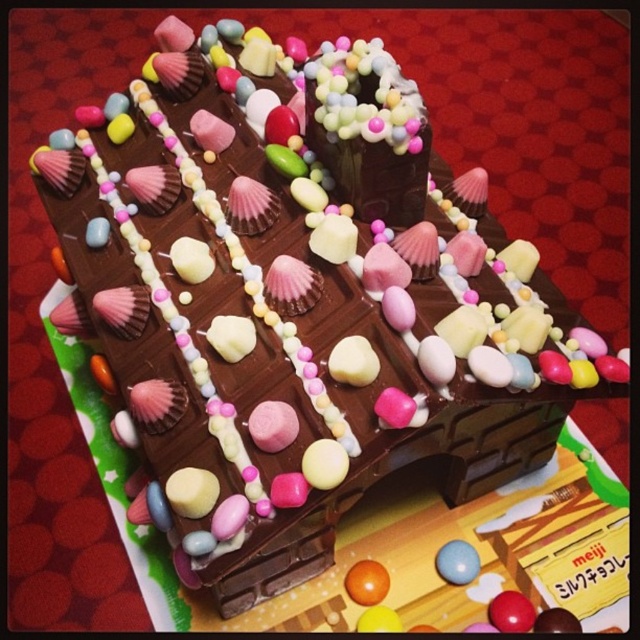
Question: Is the position of orange glossy candy at center less distant than that of matte blue sphere at center?

Choices:
 (A) yes
 (B) no

Answer: (A)

Question: Which object appears closest to the camera in this image?

Choices:
 (A) matte blue sphere at center
 (B) orange glossy candy at center

Answer: (B)

Question: Among these objects, which one is farthest from the camera?

Choices:
 (A) matte blue sphere at center
 (B) orange glossy candy at center

Answer: (A)

Question: Which point appears farthest from the camera in this image?

Choices:
 (A) tap(355, 595)
 (B) tap(449, 576)

Answer: (B)

Question: Can you confirm if orange glossy candy at center is positioned to the right of matte blue sphere at center?

Choices:
 (A) no
 (B) yes

Answer: (A)

Question: Is orange glossy candy at center positioned at the back of matte blue sphere at center?

Choices:
 (A) yes
 (B) no

Answer: (B)